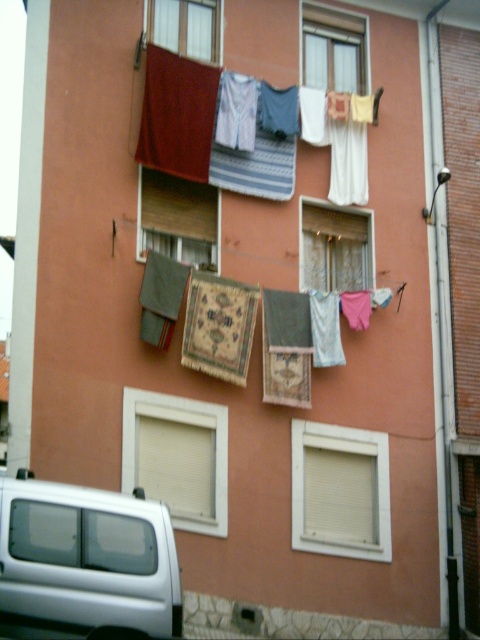
Between point (117, 544) and point (363, 236), which one is positioned in front?

Point (117, 544) is in front.

Who is more distant from viewer, (79, 512) or (311, 241)?

Positioned behind is point (311, 241).

The height and width of the screenshot is (640, 480). Identify the location of silver metallic van at lower left. (87, 557).

Is white matte window at lower left above white fabric at center?

Incorrect, white matte window at lower left is not positioned above white fabric at center.

How distant is white matte window at lower left from white fabric at center?

white matte window at lower left is 5.21 meters away from white fabric at center.

The width and height of the screenshot is (480, 640). Describe the element at coordinates (178, 456) in the screenshot. I see `white matte window at lower left` at that location.

The width and height of the screenshot is (480, 640). I want to click on white matte window at lower left, so 178,456.

Does white matte window at lower left appear under matte glass window at upper center?

Yes.

What do you see at coordinates (178, 456) in the screenshot? This screenshot has width=480, height=640. I see `white matte window at lower left` at bounding box center [178, 456].

Between point (183, 464) and point (200, 3), which one is positioned behind?

Point (200, 3)

Locate an element on the screen. white matte window at lower left is located at coordinates (178, 456).